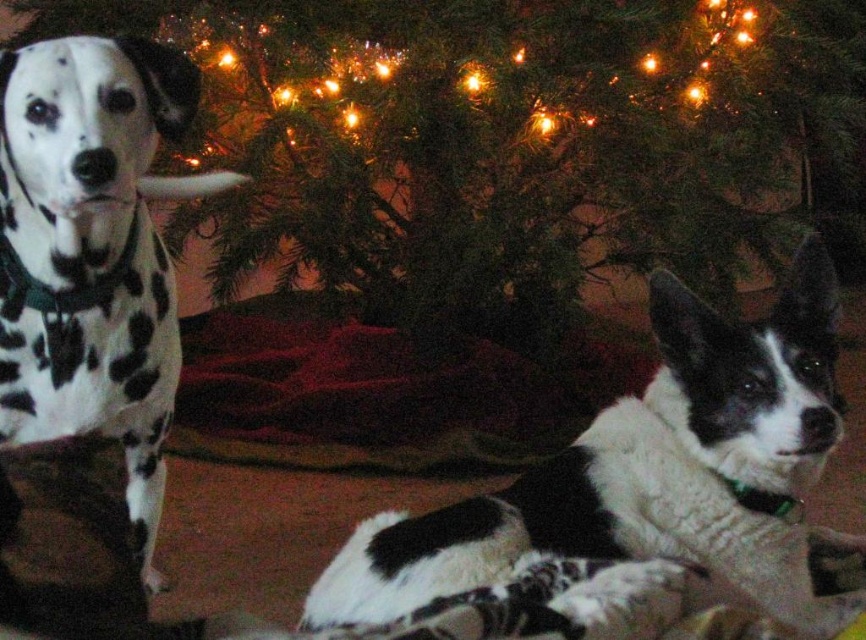
You are standing in front of the Christmas tree and want to place a gift under it. Based on the coordinates provided, where exactly should you place the gift relative to the green textured christmas tree at center?

The green textured christmas tree at center is located at point 0.220 in the x and 0.615 in the y coordinates. To place the gift under it, you should position it directly below the tree at the same x coordinate, around 0.220, but lower on the y axis, perhaps around 0.650 to 0.700 to ensure it is under the tree.

You are a photographer setting up for a Christmas photo session. You have two dogs in front of the tree. The dogs are the black and white fur at lower right and the spotted fur dog at left. Which dog should you focus on first if you want to capture the one that takes up more space in the frame?

The black and white fur at lower right is larger in size compared to the spotted fur dog at left, so you should focus on the black and white fur at lower right first to capture the one that takes up more space in the frame.

You are a photographer setting up a Christmas photo shoot. You need to ensure that the black and white fur at lower right and the spotted fur dog at left are both in frame. Based on their positions, which dog should you adjust first to ensure both are visible?

The black and white fur at lower right is positioned under the spotted fur dog at left. To ensure both are visible, you should adjust the spotted fur dog at left first, as it is above the other dog and moving it would allow the lower dog to be seen.